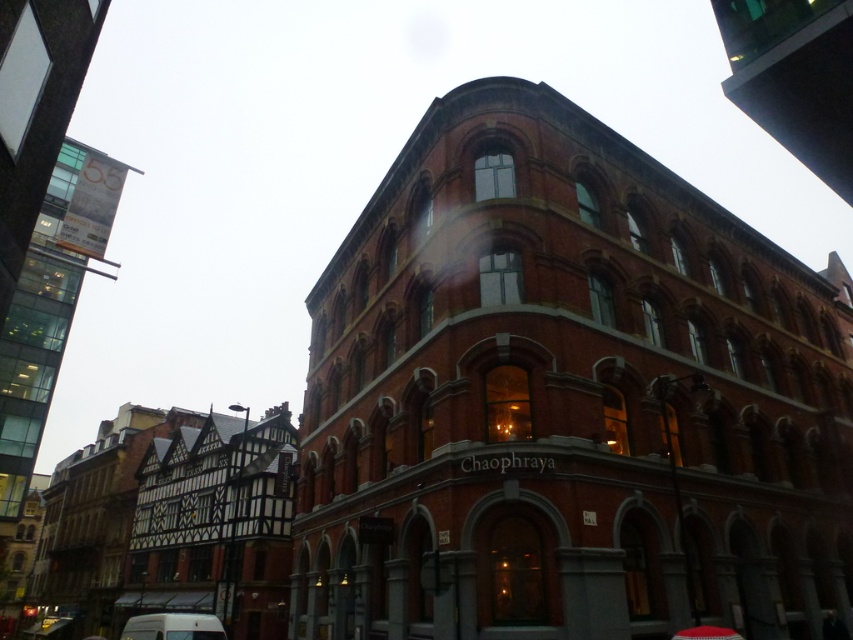
You are standing at the corner where the two buildings meet. If you want to take a photo of the red brick building at center, where should you position yourself relative to the corner?

You should position yourself at point (566,397) to take a photo of the red brick building at center.

You are driving a delivery truck and need to park it near the red brick building at center. The parking spot is located to the left of the white matte van at lower left. Can you park your truck there without blocking the van?

The red brick building at center is to the right of the white matte van at lower left. Since the parking spot is to the left of the van, parking there would place your truck further left than the van, so it won generated by you. 1. You must follow all the rules above. 2. Do not use the example question provided in the input. 3. Your question must be different from the example. 4. Your question must be based on the given scene and objects. 5. Your question must involve spatial reasoning. 6. Your answer must

You are standing at the point marked by coordinates point (566, 397). Which building are you facing? The red brick building at center or the half timbered building on the left?

You are facing the red brick building at center because the point (566, 397) represents its location.